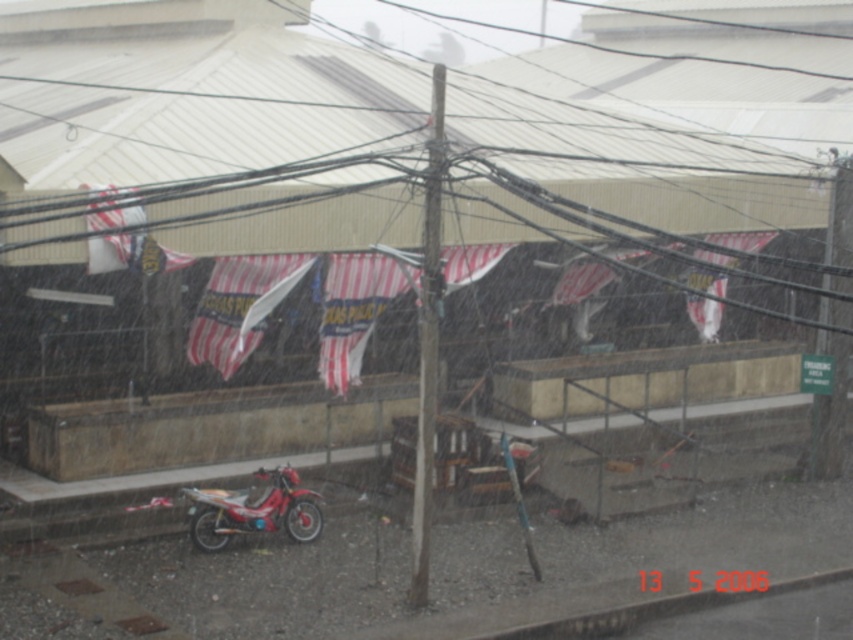
Question: Which object appears closest to the camera in this image?

Choices:
 (A) smooth wooden pole at center
 (B) shiny red motorcycle at lower left

Answer: (A)

Question: Where is smooth wooden pole at center located in relation to shiny red motorcycle at lower left in the image?

Choices:
 (A) below
 (B) above

Answer: (B)

Question: Is smooth wooden pole at center positioned at the back of shiny red motorcycle at lower left?

Choices:
 (A) no
 (B) yes

Answer: (A)

Question: Is smooth wooden pole at center below shiny red motorcycle at lower left?

Choices:
 (A) yes
 (B) no

Answer: (B)

Question: Which point is farther to the camera?

Choices:
 (A) shiny red motorcycle at lower left
 (B) smooth wooden pole at center

Answer: (A)